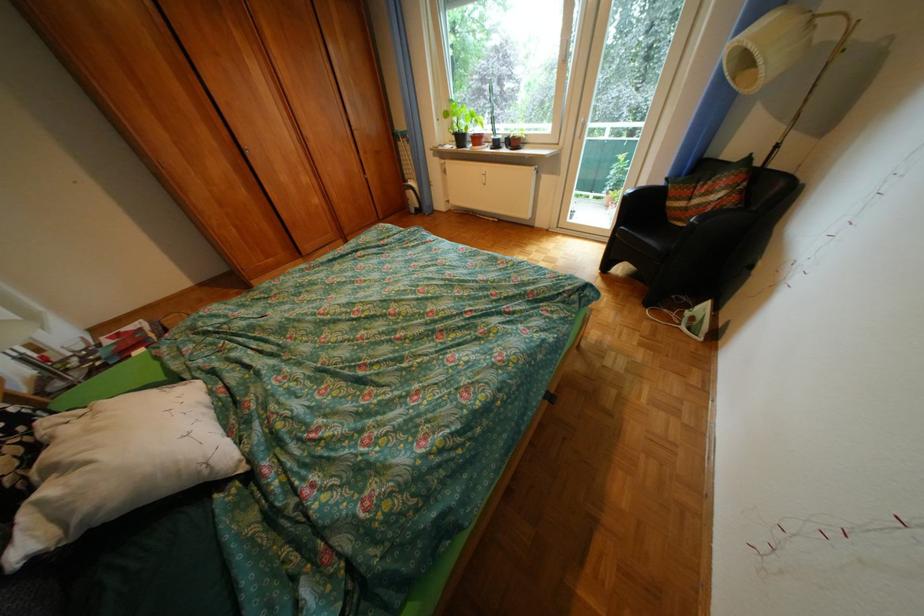
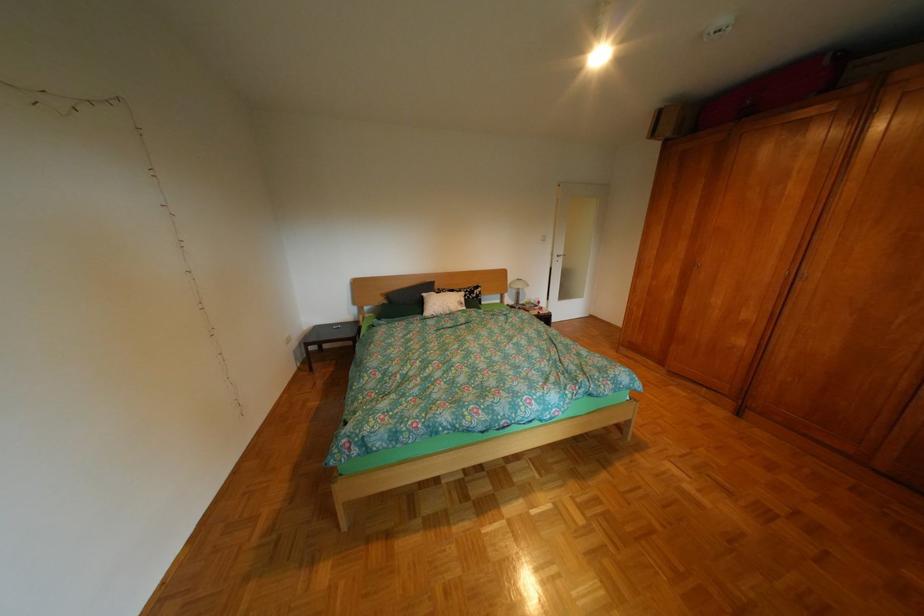
The point at [43,546] is marked in the first image. Where is the corresponding point in the second image?

(439, 294)